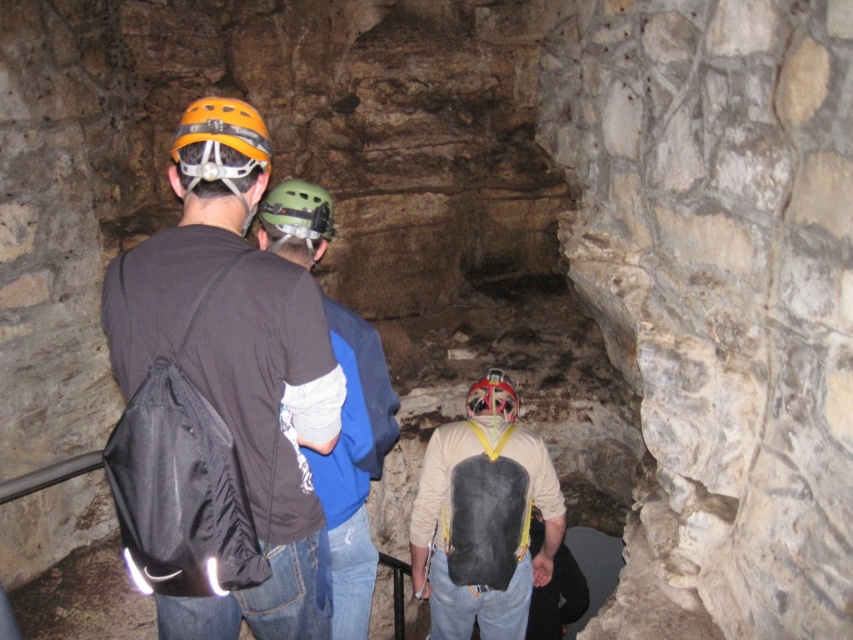
You are navigating a dark cave and need to locate the matte black vest at center. According to the coordinates provided, where exactly is the matte black vest positioned in the cave?

The matte black vest at center is located at point 0.809 on the x axis and 0.567 on the y axis.

You are a caver preparing to enter a narrow tunnel. You notice two helmets in your inventory, the green matte helmet at center and the red matte helmet at center. Which helmet would be more suitable to wear through the tunnel to avoid hitting your head?

The green matte helmet at center is much taller than the red matte helmet at center, so the red matte helmet at center would be more suitable to wear through the narrow tunnel to avoid hitting your head.

In the scene shown: You are navigating a dark cave and need to locate the green matte helmet at center. Based on the coordinates provided, where should you focus your attention to find it?

The green matte helmet at center is located at point (294, 220), so you should focus your attention there to find it.